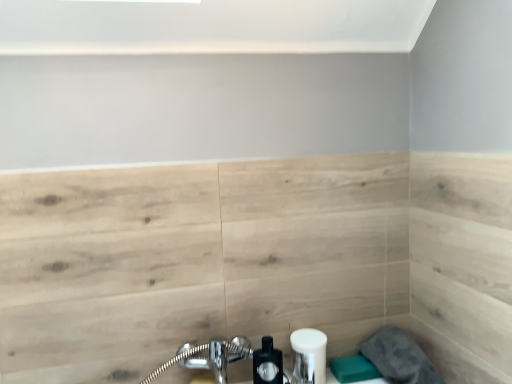
Question: Can you confirm if matte black soap dispenser at lower center is positioned to the right of gray fabric towel at lower right?

Choices:
 (A) yes
 (B) no

Answer: (B)

Question: Can you confirm if matte black soap dispenser at lower center is shorter than gray fabric towel at lower right?

Choices:
 (A) no
 (B) yes

Answer: (A)

Question: Considering the relative positions of matte black soap dispenser at lower center and gray fabric towel at lower right in the image provided, is matte black soap dispenser at lower center in front of gray fabric towel at lower right?

Choices:
 (A) no
 (B) yes

Answer: (A)

Question: Is matte black soap dispenser at lower center positioned with its back to gray fabric towel at lower right?

Choices:
 (A) yes
 (B) no

Answer: (B)

Question: Is the surface of matte black soap dispenser at lower center in direct contact with gray fabric towel at lower right?

Choices:
 (A) yes
 (B) no

Answer: (B)

Question: From the image's perspective, does matte black soap dispenser at lower center appear higher than gray fabric towel at lower right?

Choices:
 (A) no
 (B) yes

Answer: (B)

Question: From the image's perspective, does gray fabric towel at lower right appear higher than white matte soap dispenser at lower center?

Choices:
 (A) yes
 (B) no

Answer: (B)

Question: From the image's perspective, is gray fabric towel at lower right under white matte soap dispenser at lower center?

Choices:
 (A) yes
 (B) no

Answer: (A)

Question: From a real-world perspective, is gray fabric towel at lower right located beneath white matte soap dispenser at lower center?

Choices:
 (A) yes
 (B) no

Answer: (A)

Question: Is gray fabric towel at lower right to the right of white matte soap dispenser at lower center from the viewer's perspective?

Choices:
 (A) yes
 (B) no

Answer: (A)

Question: Can you confirm if gray fabric towel at lower right is wider than white matte soap dispenser at lower center?

Choices:
 (A) yes
 (B) no

Answer: (A)

Question: Does gray fabric towel at lower right have a larger size compared to white matte soap dispenser at lower center?

Choices:
 (A) no
 (B) yes

Answer: (B)

Question: Are gray fabric towel at lower right and matte black soap dispenser at lower center far apart?

Choices:
 (A) no
 (B) yes

Answer: (A)